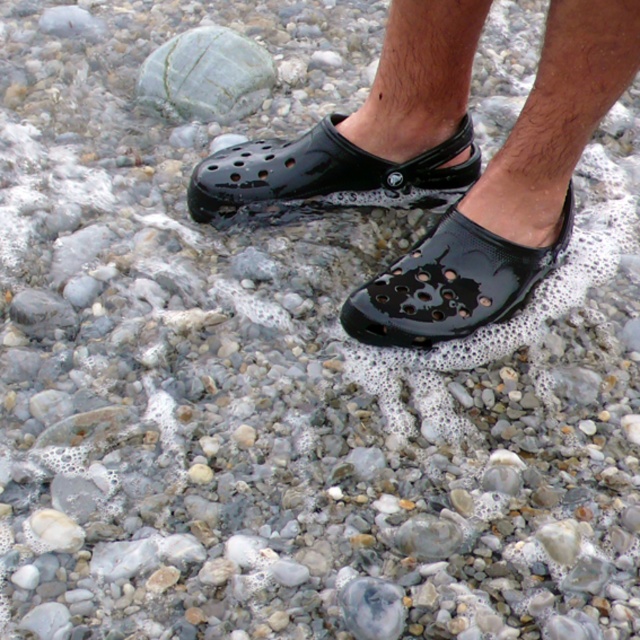
Looking at this image, is black rubber clog at center closer to the viewer compared to glossy black clog at center?

No.

Is point (317, 131) behind point (378, 305)?

That is True.

Is point (369, 172) in front of point (374, 292)?

No.

Identify the location of black rubber clog at center. (324, 177).

Consider the image. Does glossy plastic shoes at center have a greater width compared to green marble rock at upper left?

Correct, the width of glossy plastic shoes at center exceeds that of green marble rock at upper left.

Is point (419, 305) positioned in front of point (182, 104)?

Yes, it is.

Is point (456, 316) positioned behind point (253, 48)?

No, it is in front of (253, 48).

The width and height of the screenshot is (640, 640). I want to click on glossy plastic shoes at center, so click(445, 163).

Between black rubber clog at center and green marble rock at upper left, which one has less height?

Standing shorter between the two is black rubber clog at center.

Is black rubber clog at center bigger than green marble rock at upper left?

Correct, black rubber clog at center is larger in size than green marble rock at upper left.

The image size is (640, 640). I want to click on black rubber clog at center, so click(324, 177).